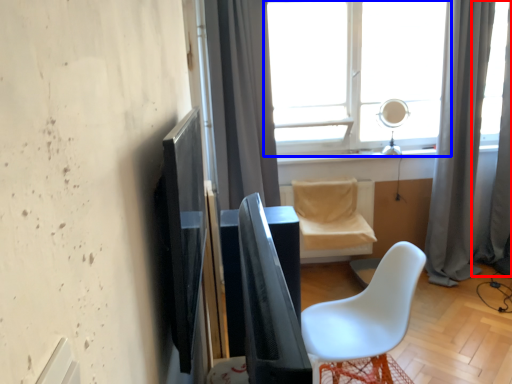
Question: Which object is closer to the camera taking this photo, curtain (highlighted by a red box) or window (highlighted by a blue box)?

Choices:
 (A) curtain
 (B) window

Answer: (A)